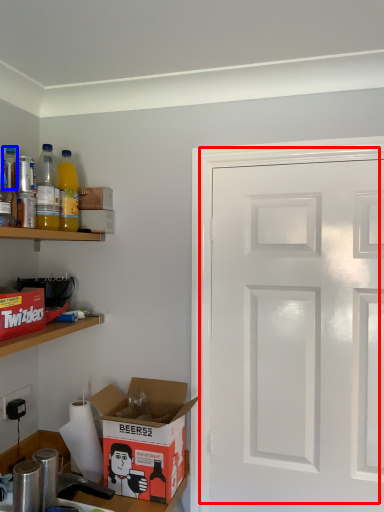
Question: Which point is closer to the camera, door (highlighted by a red box) or bottle (highlighted by a blue box)?

Choices:
 (A) door
 (B) bottle

Answer: (B)